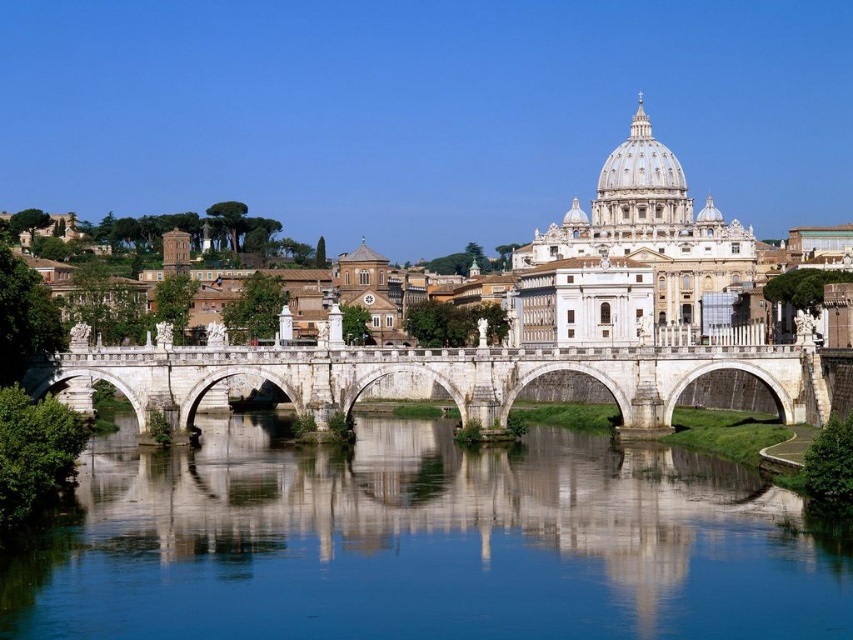
Question: Is clear blue water at center above white stone bridge at center?

Choices:
 (A) no
 (B) yes

Answer: (A)

Question: Is clear blue water at center below white stone bridge at center?

Choices:
 (A) no
 (B) yes

Answer: (B)

Question: Which of the following is the farthest from the observer?

Choices:
 (A) white stone bridge at center
 (B) clear blue water at center

Answer: (A)

Question: Which of the following is the closest to the observer?

Choices:
 (A) clear blue water at center
 (B) white stone bridge at center

Answer: (A)

Question: Is clear blue water at center below white stone bridge at center?

Choices:
 (A) no
 (B) yes

Answer: (B)